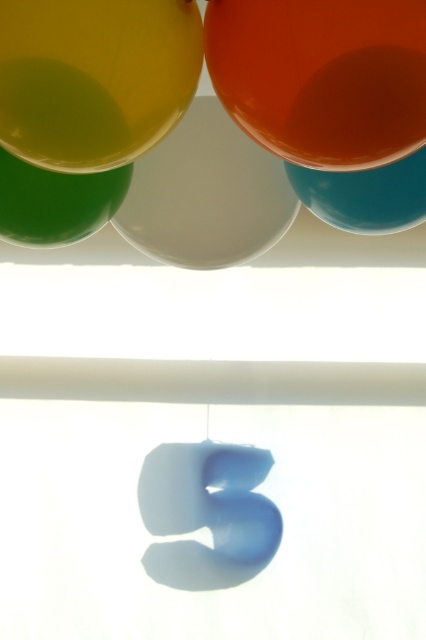
Who is shorter, glossy orange balloon at upper center or translucent yellow balloon at upper left?

glossy orange balloon at upper center is shorter.

In the scene shown: Is glossy orange balloon at upper center positioned before translucent yellow balloon at upper left?

That is True.

In order to click on glossy orange balloon at upper center in this screenshot , I will do `click(322, 76)`.

Who is more distant from viewer, (x=149, y=140) or (x=40, y=211)?

Point (x=40, y=211)

This screenshot has height=640, width=426. Describe the element at coordinates (94, 77) in the screenshot. I see `translucent yellow balloon at upper left` at that location.

Which is in front, point (169, 90) or point (20, 208)?

Positioned in front is point (169, 90).

This screenshot has height=640, width=426. In order to click on translucent yellow balloon at upper left in this screenshot , I will do `click(94, 77)`.

Who is positioned more to the right, glossy white balloon at center or teal glossy balloon at upper right?

teal glossy balloon at upper right is more to the right.

Is point (169, 234) farther from viewer compared to point (394, 170)?

Yes, it is behind point (394, 170).

Where is `glossy white balloon at center`? This screenshot has width=426, height=640. glossy white balloon at center is located at coordinates (206, 195).